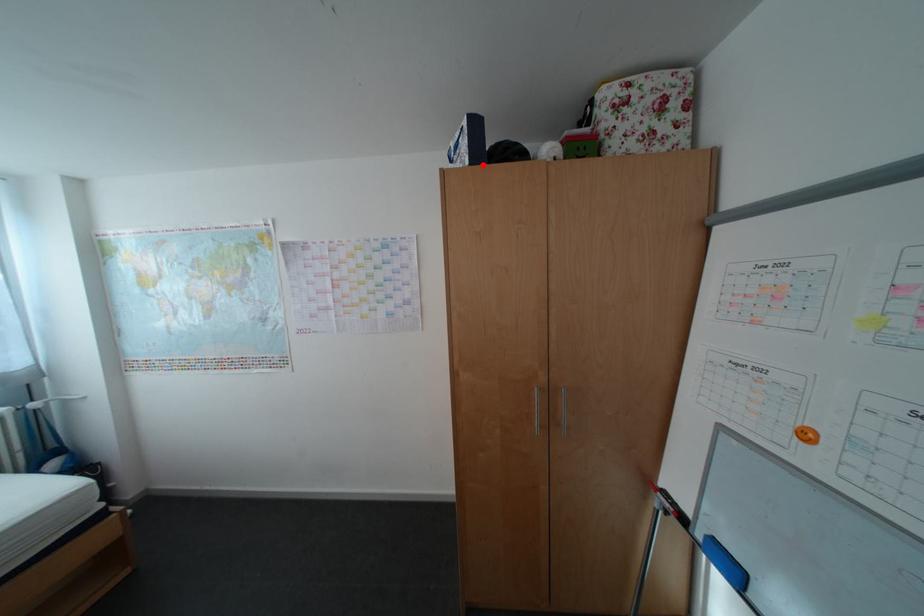
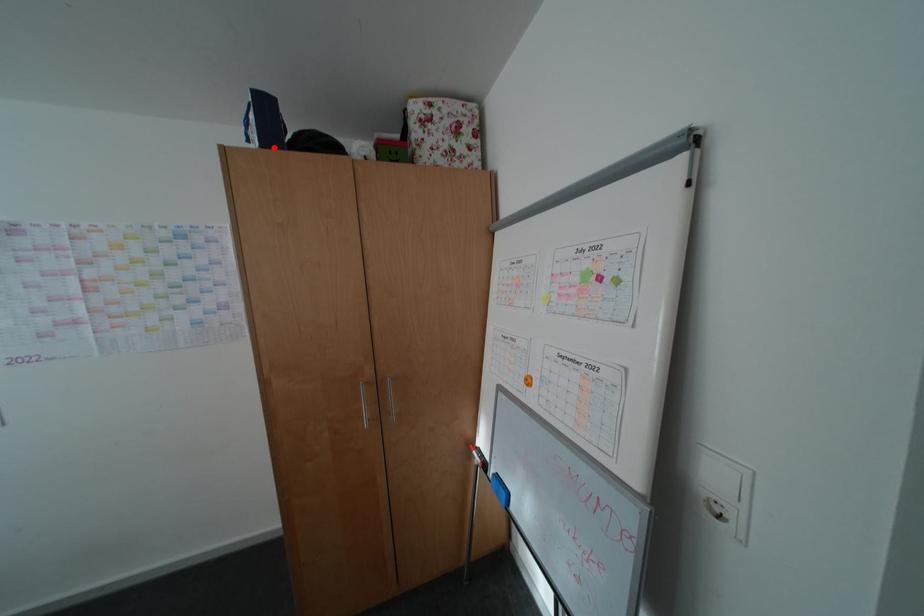
I am providing you with two images of the same scene from different viewpoints. A red point is marked on the first image and another point is marked on the second image. Do the highlighted points in image1 and image2 indicate the same real-world spot?

Yes